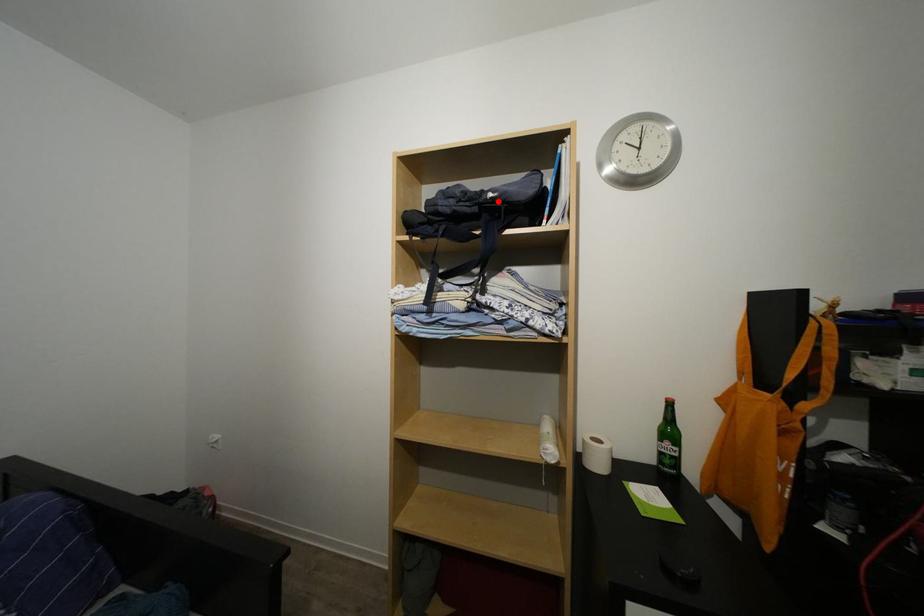
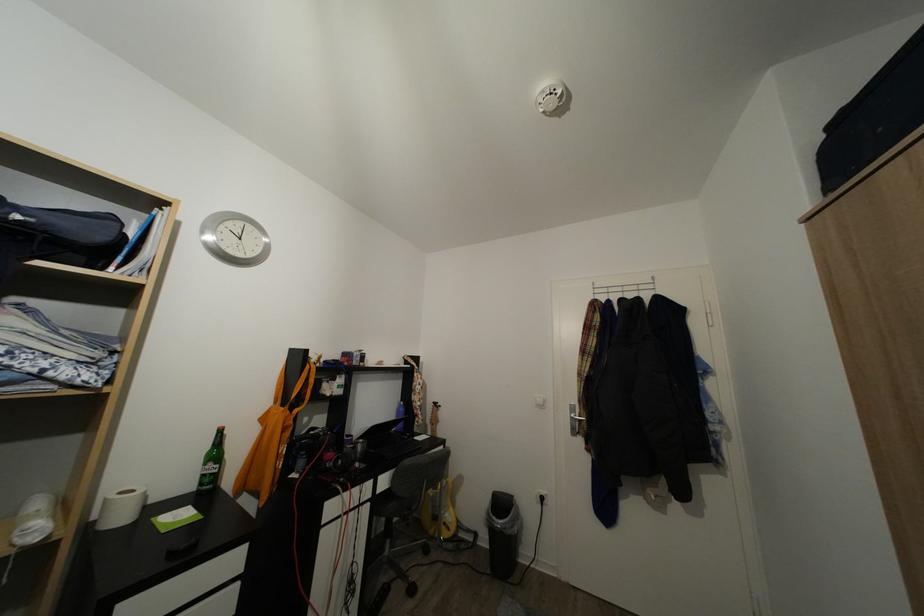
Where in the second image is the point corresponding to the highlighted location from the first image?

(25, 223)